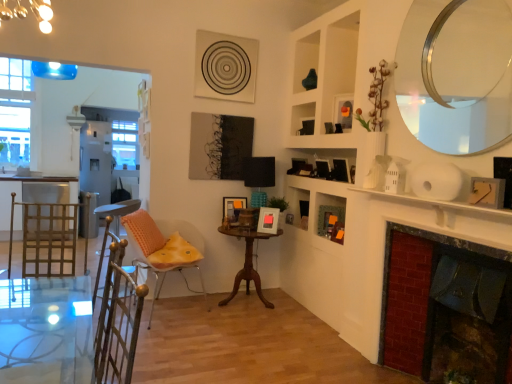
Question: Should I look upward or downward to see clear glass window at upper left?

Choices:
 (A) up
 (B) down

Answer: (A)

Question: Is white glossy screen door at left oriented away from orange matte picture frame at upper center, acting as the fourth picture frame starting from the bottom?

Choices:
 (A) no
 (B) yes

Answer: (A)

Question: Can you confirm if white glossy screen door at left is shorter than orange matte picture frame at upper center, which ranks as the 3th picture frame in back-to-front order?

Choices:
 (A) no
 (B) yes

Answer: (A)

Question: Is white glossy screen door at left taller than orange matte picture frame at upper center, acting as the fourth picture frame starting from the bottom?

Choices:
 (A) no
 (B) yes

Answer: (B)

Question: Does white glossy screen door at left have a lesser width compared to orange matte picture frame at upper center, which ranks as the 3th picture frame in back-to-front order?

Choices:
 (A) no
 (B) yes

Answer: (A)

Question: Is white glossy screen door at left closer to the viewer compared to orange matte picture frame at upper center, which is the 2th picture frame in front-to-back order?

Choices:
 (A) no
 (B) yes

Answer: (A)

Question: Is white glossy screen door at left far away from orange matte picture frame at upper center, which ranks as the 3th picture frame in back-to-front order?

Choices:
 (A) yes
 (B) no

Answer: (A)

Question: Would you consider wooden picture frame at upper right, which is counted as the first picture frame, starting from the right, to be distant from clear glass window at upper left?

Choices:
 (A) yes
 (B) no

Answer: (A)

Question: Considering the relative positions of wooden picture frame at upper right, positioned as the 3th picture frame in bottom-to-top order, and clear glass window at upper left in the image provided, is wooden picture frame at upper right, positioned as the 3th picture frame in bottom-to-top order, behind clear glass window at upper left?

Choices:
 (A) yes
 (B) no

Answer: (B)

Question: From a real-world perspective, is wooden picture frame at upper right, arranged as the 1th picture frame when viewed from the front, beneath clear glass window at upper left?

Choices:
 (A) no
 (B) yes

Answer: (B)

Question: Does wooden picture frame at upper right, the fourth picture frame positioned from the back, have a lesser height compared to clear glass window at upper left?

Choices:
 (A) no
 (B) yes

Answer: (B)

Question: Is wooden picture frame at upper right, positioned as the 3th picture frame in bottom-to-top order, aimed at clear glass window at upper left?

Choices:
 (A) yes
 (B) no

Answer: (B)

Question: Can you confirm if wooden picture frame at upper right, which is counted as the first picture frame, starting from the right, is positioned to the right of clear glass window at upper left?

Choices:
 (A) no
 (B) yes

Answer: (B)

Question: Is brick fireplace at right further to camera compared to orange matte picture frame at upper center, the third picture frame when ordered from left to right?

Choices:
 (A) no
 (B) yes

Answer: (A)